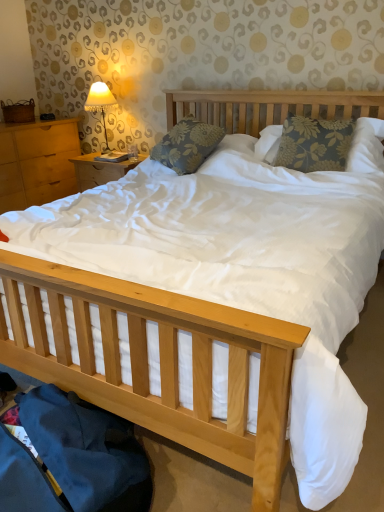
Measure the distance between point [175,159] and camera.

Point [175,159] and camera are 2.59 meters apart from each other.

Locate an element on the screen. Image resolution: width=384 pixels, height=512 pixels. floral fabric pillow at center, which is the first pillow from right to left is located at coordinates (312, 144).

Locate an element on the screen. The image size is (384, 512). light brown wood at left is located at coordinates (37, 163).

Identify the location of matte fabric lampshade at upper left. click(x=100, y=104).

From a real-world perspective, which is physically above, floral fabric pillow at center, the second pillow from the right, or light brown wood at left?

In real-world perspective, floral fabric pillow at center, the second pillow from the right, is above.

You are a GUI agent. You are given a task and a screenshot of the screen. Output one action in this format:
    pyautogui.click(x=<x>, y=<y>)
    Task: Click on the nightstand below the floral fabric pillow at center, the second pillow from the right (from the image's perspective)
    The image size is (384, 512).
    Given the screenshot: What is the action you would take?
    pyautogui.click(x=37, y=163)

Is floral fabric pillow at center, which ranks as the 1th pillow in left-to-right order, not inside light brown wood at left?

floral fabric pillow at center, which ranks as the 1th pillow in left-to-right order, lies outside light brown wood at left's area.

Relative to light brown wood at left, is floral fabric pillow at center, which ranks as the 1th pillow in left-to-right order, in front or behind?

Visually, floral fabric pillow at center, which ranks as the 1th pillow in left-to-right order, is located in front of light brown wood at left.

From a real-world perspective, who is located lower, matte fabric lampshade at upper left or floral fabric pillow at center, which ranks as the 1th pillow in left-to-right order?

floral fabric pillow at center, which ranks as the 1th pillow in left-to-right order.

Relative to floral fabric pillow at center, the second pillow from the right, is matte fabric lampshade at upper left in front or behind?

In the image, matte fabric lampshade at upper left appears behind floral fabric pillow at center, the second pillow from the right.

Which is nearer, (95,91) or (183,132)?

Point (95,91).

Who is bigger, matte fabric lampshade at upper left or floral fabric pillow at center, which ranks as the 1th pillow in left-to-right order?

With larger size is floral fabric pillow at center, which ranks as the 1th pillow in left-to-right order.

From the picture: How many degrees apart are the facing directions of light brown wood at left and matte fabric lampshade at upper left?

The facing directions of light brown wood at left and matte fabric lampshade at upper left are 87.6 degrees apart.

Does light brown wood at left turn towards matte fabric lampshade at upper left?

Yes, light brown wood at left is turned towards matte fabric lampshade at upper left.

Is light brown wood at left in front of or behind matte fabric lampshade at upper left in the image?

In the image, light brown wood at left appears in front of matte fabric lampshade at upper left.

Does point (42, 149) come closer to viewer compared to point (115, 102)?

That is False.

Where is `table lamp positioned vertically above the floral fabric pillow at center, which is the first pillow from right to left (from a real-world perspective)`? The width and height of the screenshot is (384, 512). table lamp positioned vertically above the floral fabric pillow at center, which is the first pillow from right to left (from a real-world perspective) is located at coordinates (100, 104).

Who is shorter, floral fabric pillow at center, placed as the second pillow when sorted from left to right, or matte fabric lampshade at upper left?

With less height is floral fabric pillow at center, placed as the second pillow when sorted from left to right.

Which object is positioned more to the right, floral fabric pillow at center, placed as the second pillow when sorted from left to right, or matte fabric lampshade at upper left?

floral fabric pillow at center, placed as the second pillow when sorted from left to right.

From the image's perspective, which is above, floral fabric pillow at center, which is the first pillow from right to left, or matte fabric lampshade at upper left?

From the image's view, matte fabric lampshade at upper left is above.

How many degrees apart are the facing directions of floral fabric pillow at center, which ranks as the 1th pillow in left-to-right order, and floral fabric pillow at center, placed as the second pillow when sorted from left to right?

The angular difference between floral fabric pillow at center, which ranks as the 1th pillow in left-to-right order, and floral fabric pillow at center, placed as the second pillow when sorted from left to right, is 21.6 degrees.

Is the depth of floral fabric pillow at center, the second pillow from the right, greater than that of floral fabric pillow at center, placed as the second pillow when sorted from left to right?

Yes, the depth of floral fabric pillow at center, the second pillow from the right, is greater than that of floral fabric pillow at center, placed as the second pillow when sorted from left to right.

Is floral fabric pillow at center, the second pillow from the right, oriented away from floral fabric pillow at center, placed as the second pillow when sorted from left to right?

No.

Is floral fabric pillow at center, the second pillow from the right, placed right next to floral fabric pillow at center, placed as the second pillow when sorted from left to right?

No.

Choose the correct answer: Is floral fabric pillow at center, which ranks as the 1th pillow in left-to-right order, inside matte fabric lampshade at upper left or outside it?

floral fabric pillow at center, which ranks as the 1th pillow in left-to-right order, is spatially situated outside matte fabric lampshade at upper left.

Is point (183, 146) less distant than point (98, 94)?

Yes, it is in front of point (98, 94).

Is floral fabric pillow at center, which ranks as the 1th pillow in left-to-right order, looking in the opposite direction of matte fabric lampshade at upper left?

That's not correct — floral fabric pillow at center, which ranks as the 1th pillow in left-to-right order, is not looking away from matte fabric lampshade at upper left.

Choose the correct answer: Is floral fabric pillow at center, which is the first pillow from right to left, inside floral fabric pillow at center, which ranks as the 1th pillow in left-to-right order, or outside it?

The correct answer is: outside.

Which of these two, floral fabric pillow at center, placed as the second pillow when sorted from left to right, or floral fabric pillow at center, which ranks as the 1th pillow in left-to-right order, stands taller?

floral fabric pillow at center, placed as the second pillow when sorted from left to right, is taller.

Is floral fabric pillow at center, which is the first pillow from right to left, not close to floral fabric pillow at center, the second pillow from the right?

They are positioned close to each other.

Image resolution: width=384 pixels, height=512 pixels. What are the coordinates of `nightstand behind the floral fabric pillow at center, the second pillow from the right` in the screenshot? It's located at (37, 163).

From the image's perspective, starting from the matte fabric lampshade at upper left, which pillow is the 1st one below? Please provide its 2D coordinates.

[(187, 145)]

Considering their positions, is light brown wood at left positioned closer to floral fabric pillow at center, the second pillow from the right, than matte fabric lampshade at upper left?

The object closer to floral fabric pillow at center, the second pillow from the right, is matte fabric lampshade at upper left.

Estimate the real-world distances between objects in this image. Which object is further from floral fabric pillow at center, which ranks as the 1th pillow in left-to-right order, floral fabric pillow at center, which is the first pillow from right to left, or light brown wood at left?

light brown wood at left.

Looking at the image, which one is located further to matte fabric lampshade at upper left, floral fabric pillow at center, which is the first pillow from right to left, or light brown wood at left?

floral fabric pillow at center, which is the first pillow from right to left, is further to matte fabric lampshade at upper left.

Estimate the real-world distances between objects in this image. Which object is further from floral fabric pillow at center, which is the first pillow from right to left, matte fabric lampshade at upper left or light brown wood at left?

The object further to floral fabric pillow at center, which is the first pillow from right to left, is light brown wood at left.

Considering their positions, is light brown wood at left positioned closer to floral fabric pillow at center, placed as the second pillow when sorted from left to right, than floral fabric pillow at center, which ranks as the 1th pillow in left-to-right order?

floral fabric pillow at center, which ranks as the 1th pillow in left-to-right order.

Based on their spatial positions, is matte fabric lampshade at upper left or floral fabric pillow at center, placed as the second pillow when sorted from left to right, closer to floral fabric pillow at center, the second pillow from the right?

The object closer to floral fabric pillow at center, the second pillow from the right, is floral fabric pillow at center, placed as the second pillow when sorted from left to right.

Based on their spatial positions, is floral fabric pillow at center, placed as the second pillow when sorted from left to right, or matte fabric lampshade at upper left further from floral fabric pillow at center, which ranks as the 1th pillow in left-to-right order?

Among the two, matte fabric lampshade at upper left is located further to floral fabric pillow at center, which ranks as the 1th pillow in left-to-right order.

In the scene shown: When comparing their distances from light brown wood at left, does floral fabric pillow at center, which is the first pillow from right to left, or matte fabric lampshade at upper left seem further?

Based on the image, floral fabric pillow at center, which is the first pillow from right to left, appears to be further to light brown wood at left.

Locate an element on the screen. This screenshot has width=384, height=512. pillow between light brown wood at left and floral fabric pillow at center, which is the first pillow from right to left is located at coordinates (187, 145).

Where is `pillow between matte fabric lampshade at upper left and floral fabric pillow at center, placed as the second pillow when sorted from left to right, from left to right`? pillow between matte fabric lampshade at upper left and floral fabric pillow at center, placed as the second pillow when sorted from left to right, from left to right is located at coordinates (187, 145).

You are a GUI agent. You are given a task and a screenshot of the screen. Output one action in this format:
    pyautogui.click(x=<x>, y=<y>)
    Task: Click on the table lamp located between light brown wood at left and floral fabric pillow at center, the second pillow from the right, in the left-right direction
    The image size is (384, 512).
    Given the screenshot: What is the action you would take?
    pyautogui.click(x=100, y=104)

In order to click on table lamp situated between light brown wood at left and floral fabric pillow at center, which is the first pillow from right to left, from left to right in this screenshot , I will do `click(100, 104)`.